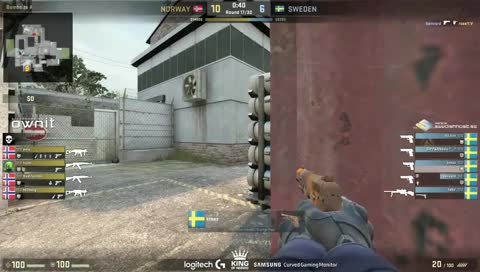
I want to click on map, so click(x=33, y=75).